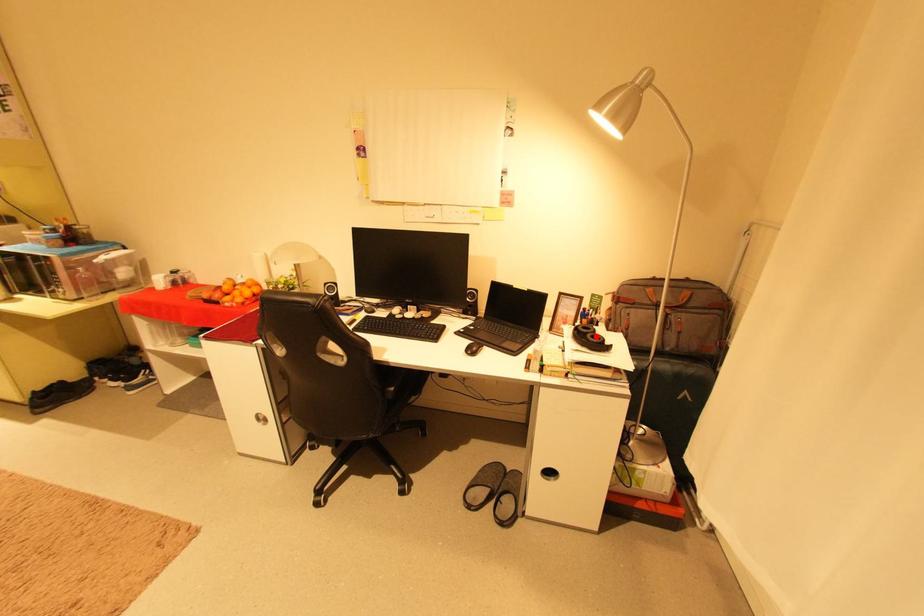
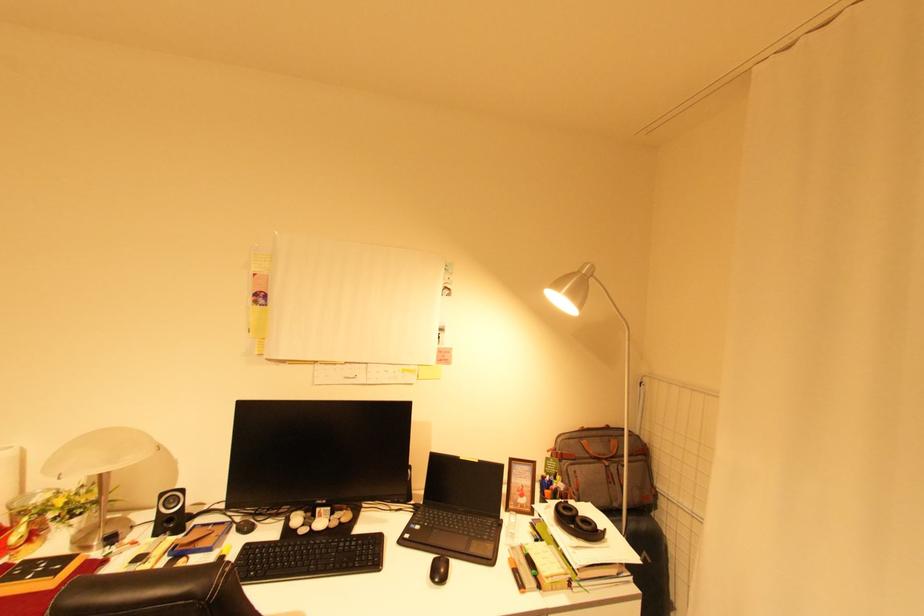
Find the pixel in the second image that matches the highlighted location in the first image.

(585, 521)